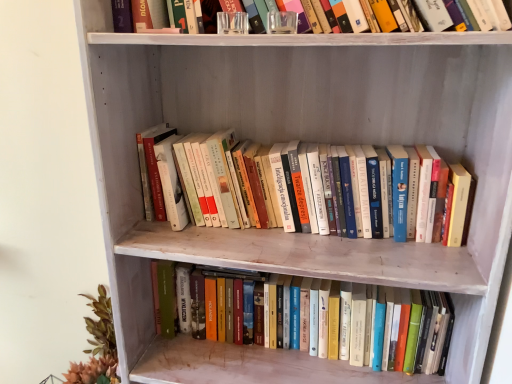
Question: From a real-world perspective, does hardcover books at center, which is the first book in bottom-to-top order, stand above hardcover books at center, the 2th book ordered from the bottom?

Choices:
 (A) no
 (B) yes

Answer: (A)

Question: Is hardcover books at center, which is the first book in bottom-to-top order, to the left of hardcover books at center, the 2th book ordered from the bottom, from the viewer's perspective?

Choices:
 (A) yes
 (B) no

Answer: (B)

Question: Is hardcover books at center, which is the first book in bottom-to-top order, in contact with hardcover books at center, the 1th book in the top-to-bottom sequence?

Choices:
 (A) no
 (B) yes

Answer: (A)

Question: Is hardcover books at center, the 2th book in the top-to-bottom sequence, to the right of hardcover books at center, the 2th book ordered from the bottom, from the viewer's perspective?

Choices:
 (A) no
 (B) yes

Answer: (B)

Question: From the image's perspective, is hardcover books at center, which is the first book in bottom-to-top order, on top of hardcover books at center, the 2th book ordered from the bottom?

Choices:
 (A) yes
 (B) no

Answer: (B)

Question: Does hardcover books at center, the 2th book in the top-to-bottom sequence, have a greater width compared to hardcover books at center, the 2th book ordered from the bottom?

Choices:
 (A) no
 (B) yes

Answer: (A)

Question: Does hardcover books at center, the 1th book in the top-to-bottom sequence, appear on the right side of hardcover books at center, the 2th book in the top-to-bottom sequence?

Choices:
 (A) no
 (B) yes

Answer: (A)

Question: From a real-world perspective, is hardcover books at center, the 2th book ordered from the bottom, located beneath hardcover books at center, which is the first book in bottom-to-top order?

Choices:
 (A) no
 (B) yes

Answer: (A)

Question: Is the position of hardcover books at center, the 1th book in the top-to-bottom sequence, more distant than that of hardcover books at center, which is the first book in bottom-to-top order?

Choices:
 (A) yes
 (B) no

Answer: (B)

Question: Considering the relative positions of hardcover books at center, the 2th book ordered from the bottom, and hardcover books at center, the 2th book in the top-to-bottom sequence, in the image provided, is hardcover books at center, the 2th book ordered from the bottom, to the left of hardcover books at center, the 2th book in the top-to-bottom sequence, from the viewer's perspective?

Choices:
 (A) no
 (B) yes

Answer: (B)

Question: Can you confirm if hardcover books at center, the 2th book ordered from the bottom, is shorter than hardcover books at center, the 2th book in the top-to-bottom sequence?

Choices:
 (A) yes
 (B) no

Answer: (A)

Question: From the image's perspective, is hardcover books at center, the 1th book in the top-to-bottom sequence, positioned above or below hardcover books at center, which is the first book in bottom-to-top order?

Choices:
 (A) below
 (B) above

Answer: (B)